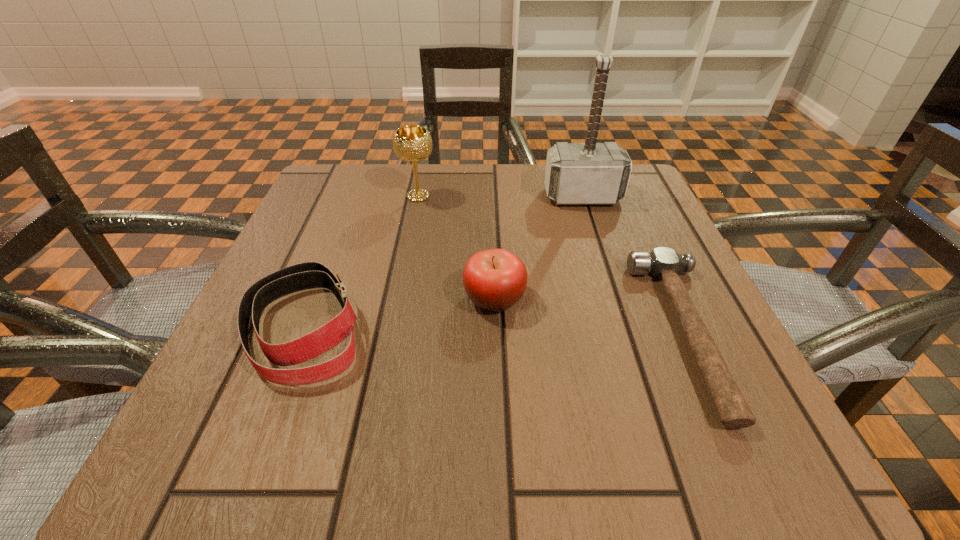
Where is `unoccupied area between the second tallest object and the dog collar`? unoccupied area between the second tallest object and the dog collar is located at coordinates (361, 261).

This screenshot has height=540, width=960. In order to click on vacant area that lies between the shortest object and the chalice in this screenshot , I will do `click(552, 265)`.

Where is `vacant space that's between the third object from right to left and the fourth shortest object`? vacant space that's between the third object from right to left and the fourth shortest object is located at coordinates (456, 247).

Where is `vacant point located between the dog collar and the fourth shortest object`? The image size is (960, 540). vacant point located between the dog collar and the fourth shortest object is located at coordinates (361, 261).

Image resolution: width=960 pixels, height=540 pixels. What are the coordinates of `vacant area that lies between the second shortest object and the tallest object` in the screenshot? It's located at (443, 262).

You are a GUI agent. You are given a task and a screenshot of the screen. Output one action in this format:
    pyautogui.click(x=<x>, y=<y>)
    Task: Click on the free space between the third shortest object and the chalice
    The height and width of the screenshot is (540, 960).
    Given the screenshot: What is the action you would take?
    pyautogui.click(x=456, y=247)

Locate an element on the screen. The height and width of the screenshot is (540, 960). vacant region between the nearer hammer and the second shortest object is located at coordinates (495, 330).

This screenshot has width=960, height=540. I want to click on vacant point located between the shortest object and the third tallest object, so click(x=590, y=316).

Where is `vacant area that lies between the chalice and the shortest object`? This screenshot has width=960, height=540. vacant area that lies between the chalice and the shortest object is located at coordinates click(552, 265).

This screenshot has height=540, width=960. I want to click on object that is the fourth closest to the shortest object, so click(x=307, y=275).